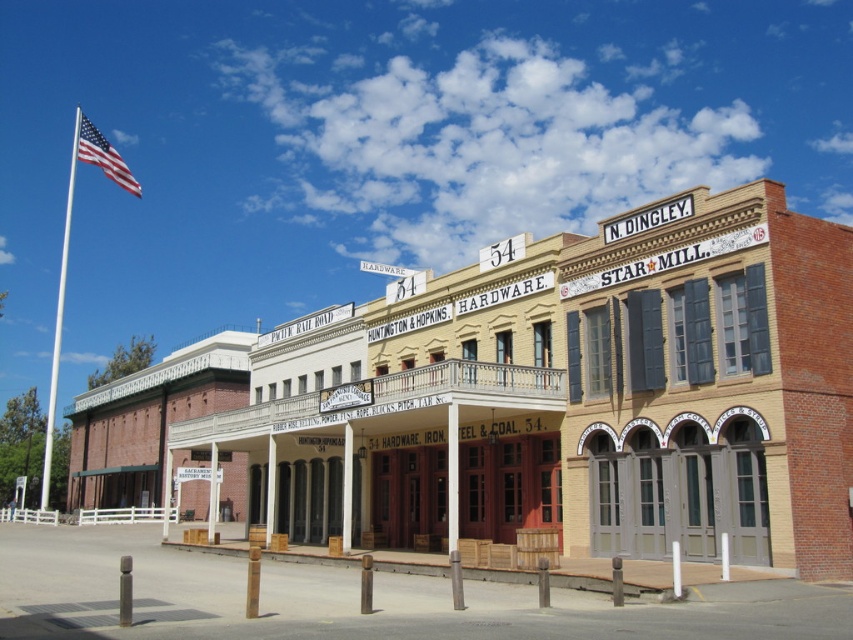
Which is below, white metallic flag pole at left or white wood sign at center?

Positioned lower is white metallic flag pole at left.

Is white metallic flag pole at left closer to the viewer compared to white wood sign at center?

No, white metallic flag pole at left is further to the viewer.

Who is more distant from viewer, (51,422) or (399,275)?

Point (51,422)

The height and width of the screenshot is (640, 853). I want to click on white metallic flag pole at left, so click(x=57, y=321).

Is brick building at center taller than white metallic flag pole at left?

Incorrect, brick building at center's height is not larger of white metallic flag pole at left's.

Between brick building at center and white metallic flag pole at left, which one is positioned lower?

Positioned lower is brick building at center.

The width and height of the screenshot is (853, 640). I want to click on brick building at center, so click(576, 394).

The image size is (853, 640). I want to click on brick building at center, so click(x=576, y=394).

Does white wooden flag pole at left have a larger size compared to white metallic flag pole at left?

Yes.

Which is in front, point (91, 150) or point (44, 500)?

Point (91, 150) is more forward.

Identify the location of white wooden flag pole at left. This screenshot has height=640, width=853. (67, 252).